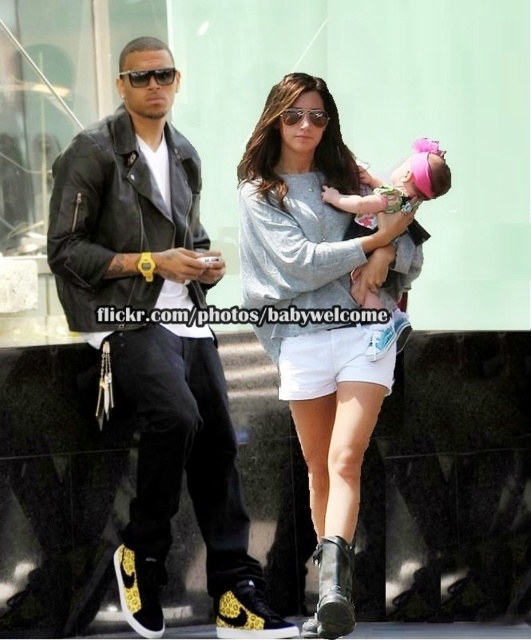
Question: Among these points, which one is nearest to the camera?

Choices:
 (A) (333, 387)
 (B) (319, 372)
 (C) (198, 376)
 (D) (431, 157)

Answer: (C)

Question: Based on their relative distances, which object is nearer to the leather jacket at left?

Choices:
 (A) gray cotton sweater at center
 (B) pink fabric baby at center

Answer: (A)

Question: Does pink fabric baby at center appear on the left side of white cotton shorts at center?

Choices:
 (A) no
 (B) yes

Answer: (A)

Question: Which of the following is the closest to the observer?

Choices:
 (A) (340, 202)
 (B) (346, 476)

Answer: (B)

Question: Is gray cotton sweater at center wider than white cotton shorts at center?

Choices:
 (A) no
 (B) yes

Answer: (B)

Question: Can you confirm if leather jacket at left is positioned above gray cotton sweater at center?

Choices:
 (A) yes
 (B) no

Answer: (A)